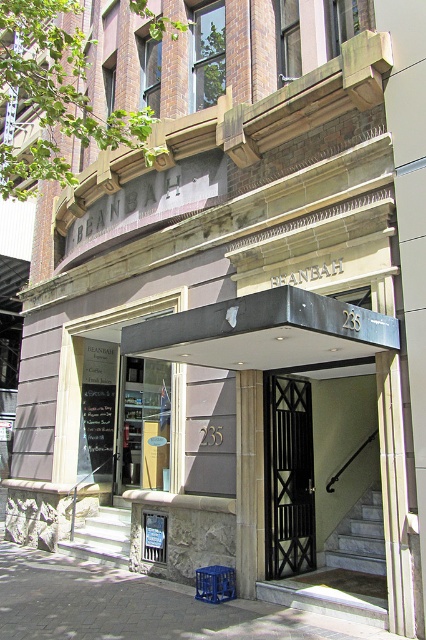
Question: Is black metal gate at center wider than clear glass door at center?

Choices:
 (A) no
 (B) yes

Answer: (A)

Question: Estimate the real-world distances between objects in this image. Which object is farther from the paved stone pavement at lower center?

Choices:
 (A) black metal gate at center
 (B) clear glass door at center
 (C) smooth stone column at center

Answer: (B)

Question: Is paved stone pavement at lower center below clear glass door at center?

Choices:
 (A) no
 (B) yes

Answer: (B)

Question: Does paved stone pavement at lower center have a lesser width compared to black metal gate at center?

Choices:
 (A) yes
 (B) no

Answer: (B)

Question: Which point is closer to the camera?

Choices:
 (A) (167, 417)
 (B) (241, 576)
 (C) (279, 428)
 (D) (301, 637)

Answer: (D)

Question: Estimate the real-world distances between objects in this image. Which object is closer to the smooth stone column at center?

Choices:
 (A) paved stone pavement at lower center
 (B) clear glass door at center
 (C) black metal gate at center

Answer: (C)